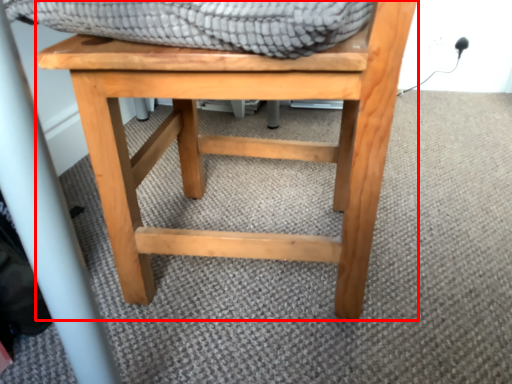
Question: From the image's perspective, what is the correct spatial positioning of stool (annotated by the red box) in reference to blanket?

Choices:
 (A) below
 (B) above

Answer: (A)